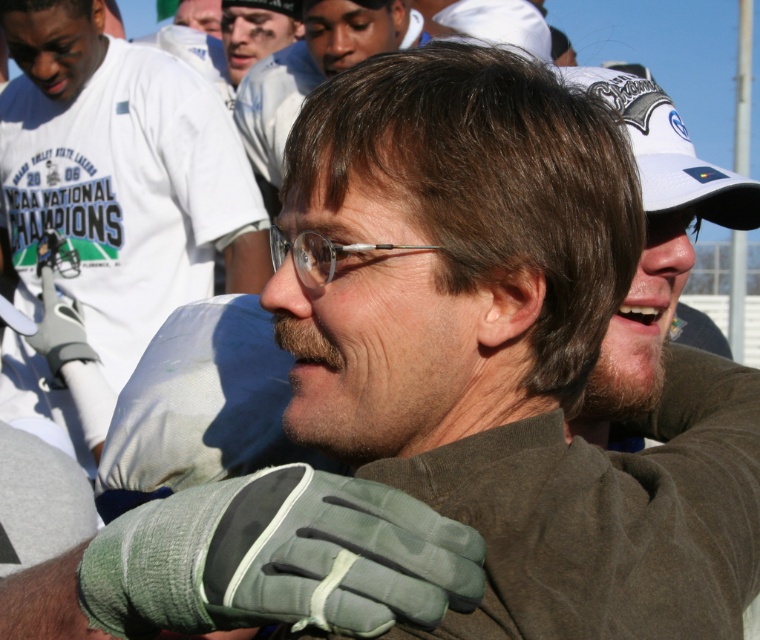
You are a photographer standing at the center of the scene. You want to take a closeup shot of the white fabric baseball cap at upper right. Considering your current position, is the cap within your camera lens range of 3.5 feet? Please explain.

The white fabric baseball cap at upper right is 4.05 feet from viewer, which is beyond the 3.5 feet camera lens range. You need to move closer by 0.55 feet to capture it in focus.

You are standing in the center of the image and want to touch the point at coordinates point (122,173). Which object should you reach for?

The point (122,173) is located on the green fabric glove at center, so you should reach for the green fabric glove at center to touch that point.